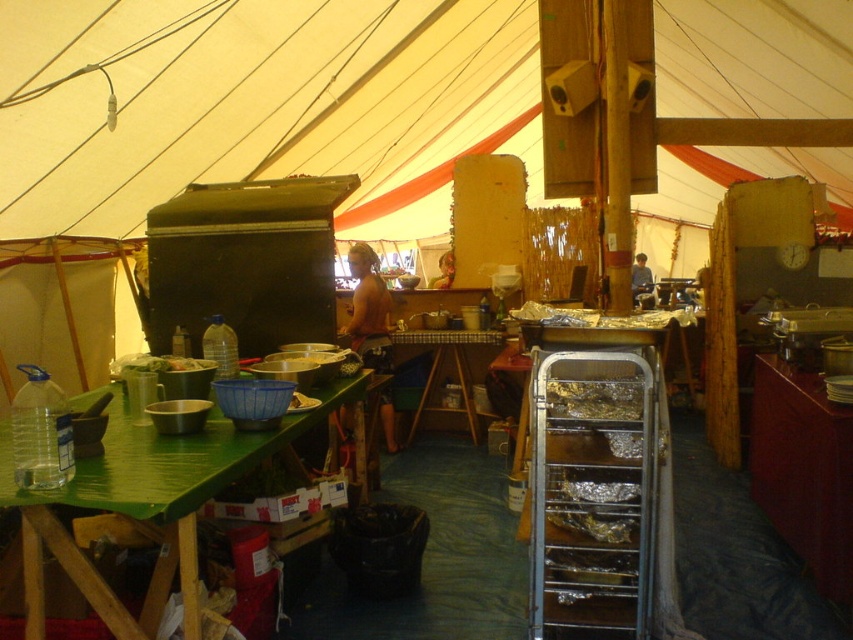
Is point (231, 442) more distant than point (462, 332)?

No, it is in front of (462, 332).

Is green bamboo table at lower left positioned in front of wooden table at center?

Yes, green bamboo table at lower left is closer to the viewer.

Locate an element on the screen. This screenshot has height=640, width=853. green bamboo table at lower left is located at coordinates (151, 502).

Is point (843, 596) closer to camera compared to point (485, 344)?

Yes, it is.

You are a GUI agent. You are given a task and a screenshot of the screen. Output one action in this format:
    pyautogui.click(x=<x>, y=<y>)
    Task: Click on the brown wood table at lower right
    The height and width of the screenshot is (640, 853).
    Given the screenshot: What is the action you would take?
    pyautogui.click(x=804, y=470)

Is point (172, 515) farther from camera compared to point (778, 362)?

No.

Where is `green bamboo table at lower left`? The height and width of the screenshot is (640, 853). green bamboo table at lower left is located at coordinates (151, 502).